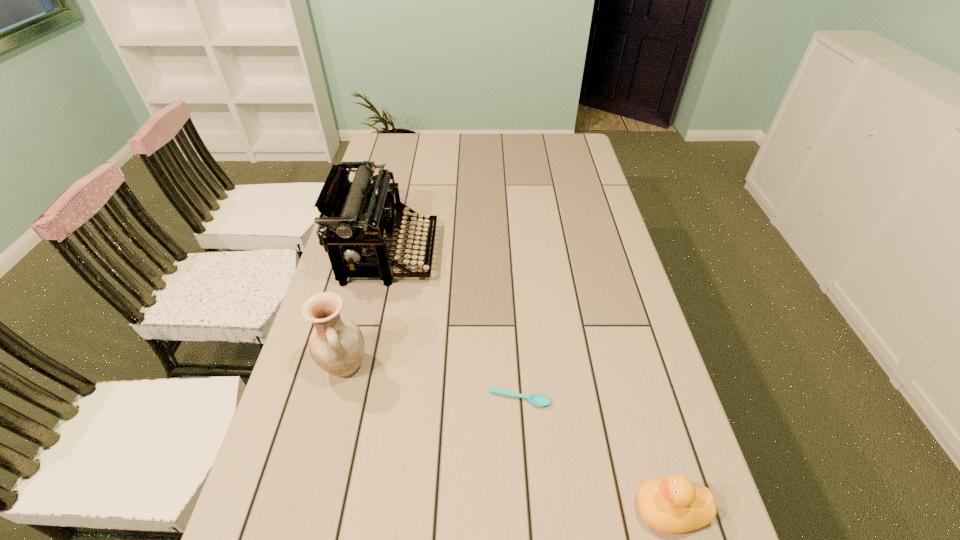
Find the location of `free spot between the shortest object and the typewriter`. free spot between the shortest object and the typewriter is located at coordinates (454, 326).

Identify the location of free space between the typewriter and the rightmost object. The image size is (960, 540). (530, 381).

This screenshot has height=540, width=960. I want to click on vacant area that lies between the nearest object and the spoon, so [594, 454].

In order to click on free space between the second shortest object and the farthest object in this screenshot , I will do `click(530, 381)`.

This screenshot has width=960, height=540. What are the coordinates of `empty location between the nearest object and the spoon` in the screenshot? It's located at (594, 454).

Identify the location of empty location between the rightmost object and the shortest object. (594, 454).

Identify the location of unoccupied position between the farthest object and the rightmost object. (530, 381).

I want to click on empty space that is in between the pottery and the typewriter, so click(x=367, y=309).

You are a GUI agent. You are given a task and a screenshot of the screen. Output one action in this format:
    pyautogui.click(x=<x>, y=<y>)
    Task: Click on the free space between the nearest object and the spoon
    
    Given the screenshot: What is the action you would take?
    pyautogui.click(x=594, y=454)

This screenshot has height=540, width=960. Identify the location of the second closest object to the second shortest object. (336, 344).